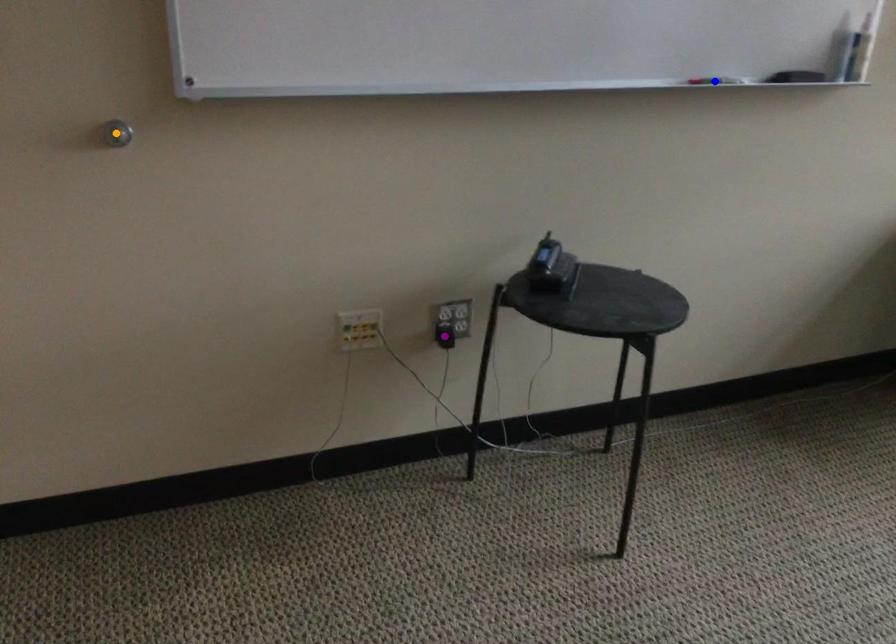
Order these from nearest to farthest:
A) blue point
B) orange point
C) purple point

1. orange point
2. blue point
3. purple point